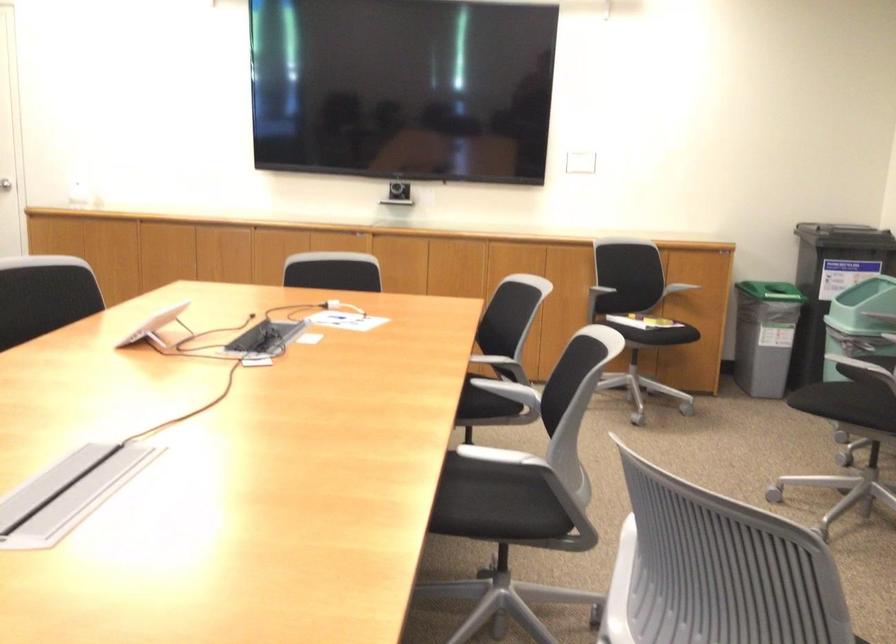
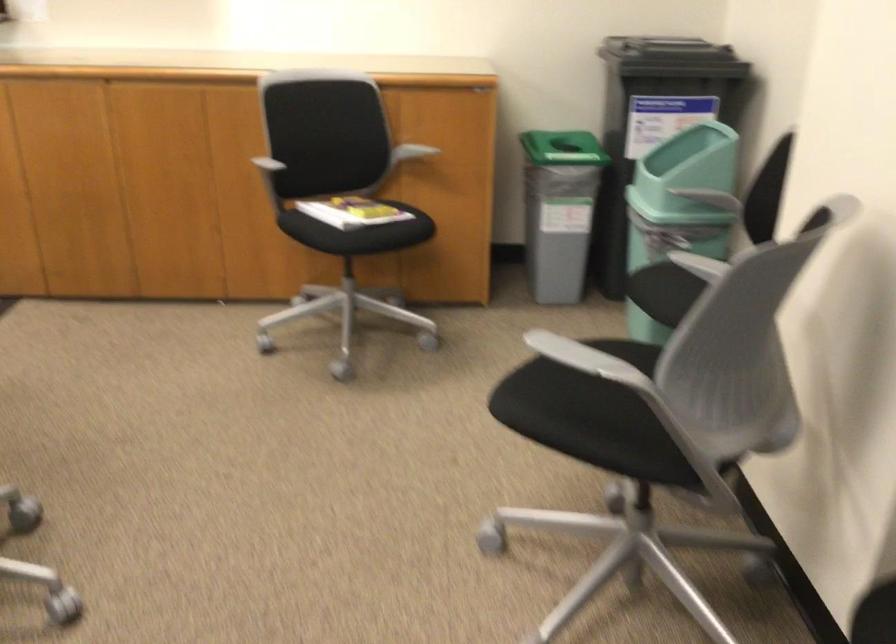
Find the pixel in the second image that matches (x=650, y=315) in the first image.

(358, 232)